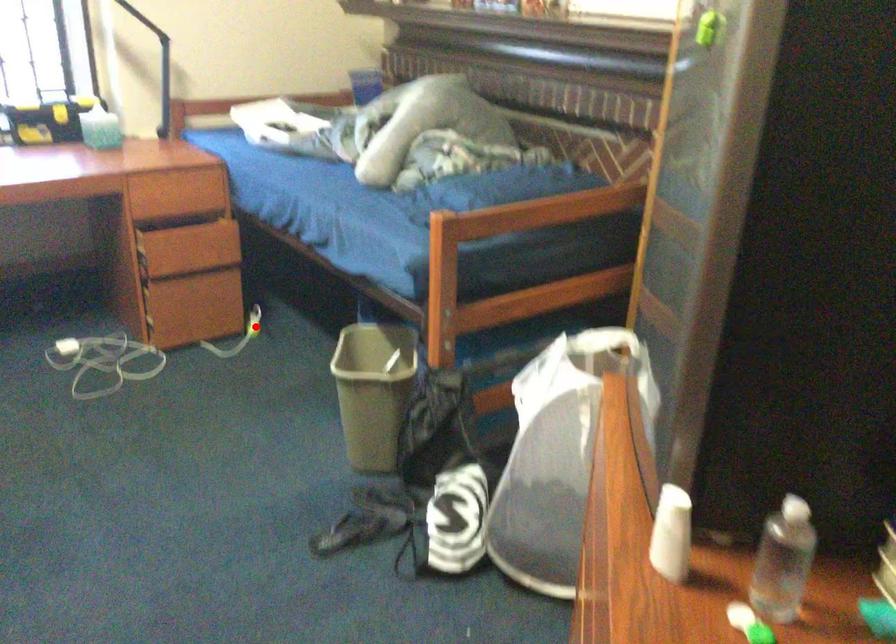
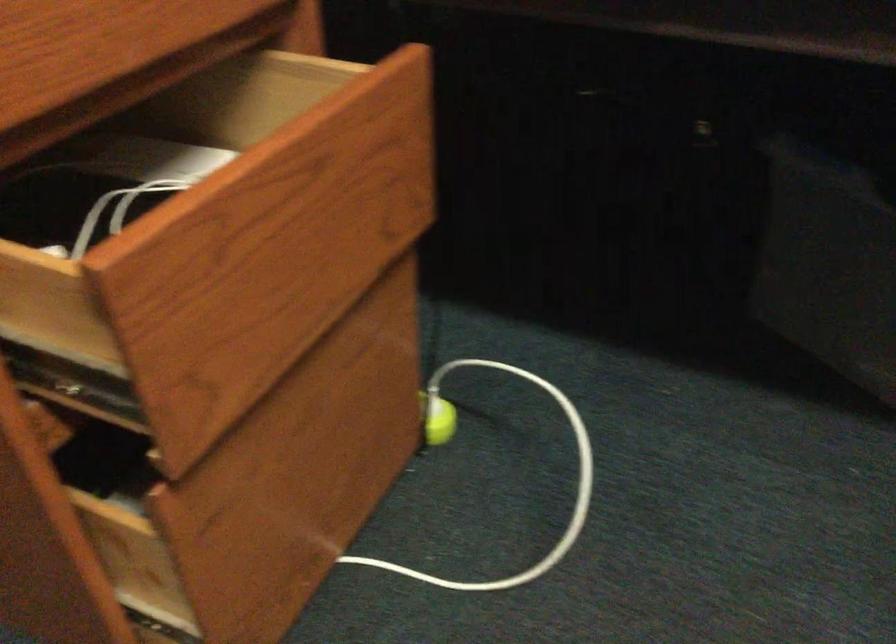
Question: I am providing you with two images of the same scene from different viewpoints. A red point is shown in image1. For the corresponding object point in image2, is it positioned nearer or farther from the camera?

Choices:
 (A) Nearer
 (B) Farther

Answer: (A)